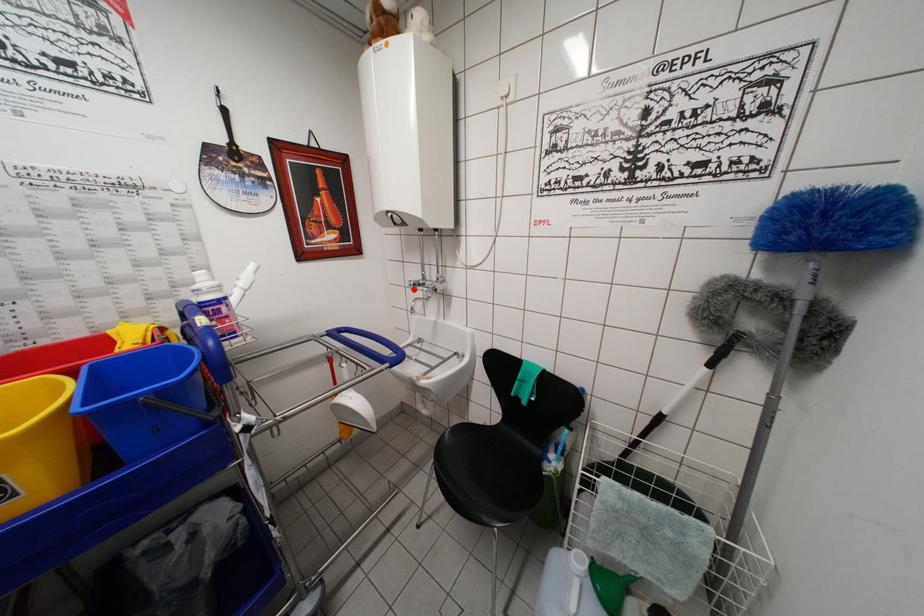
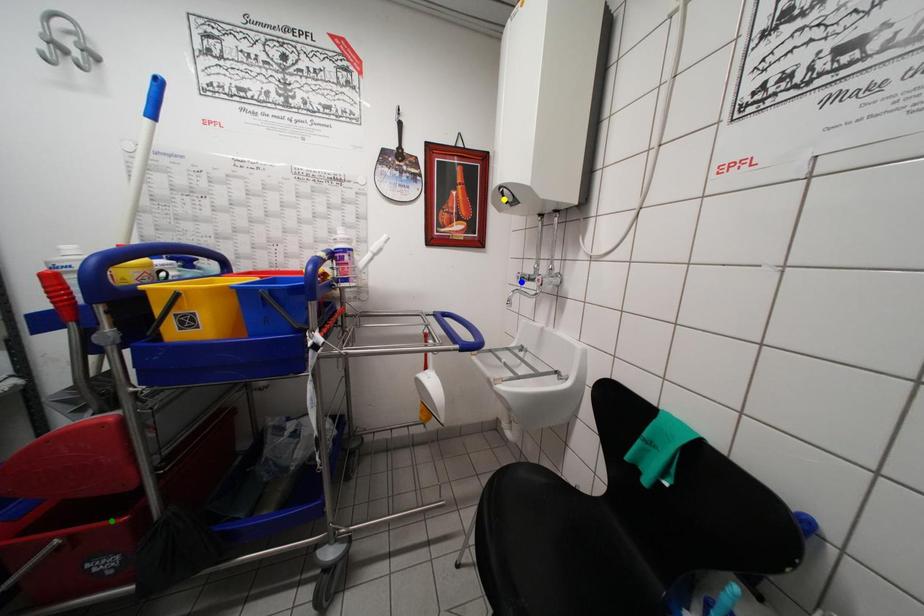
Question: I am providing you with two images of the same scene from different viewpoints. A red point is marked on the first image. You are given multiple points on the second image. Which point in image 2 represents the same 3d spot as the red point in image 1?

Choices:
 (A) green point
 (B) blue point
 (C) yellow point

Answer: (B)